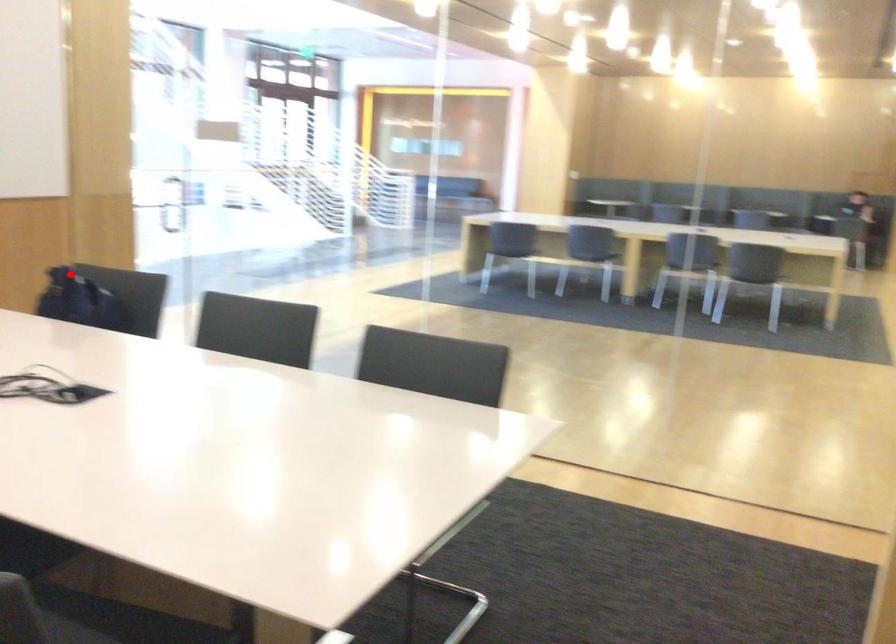
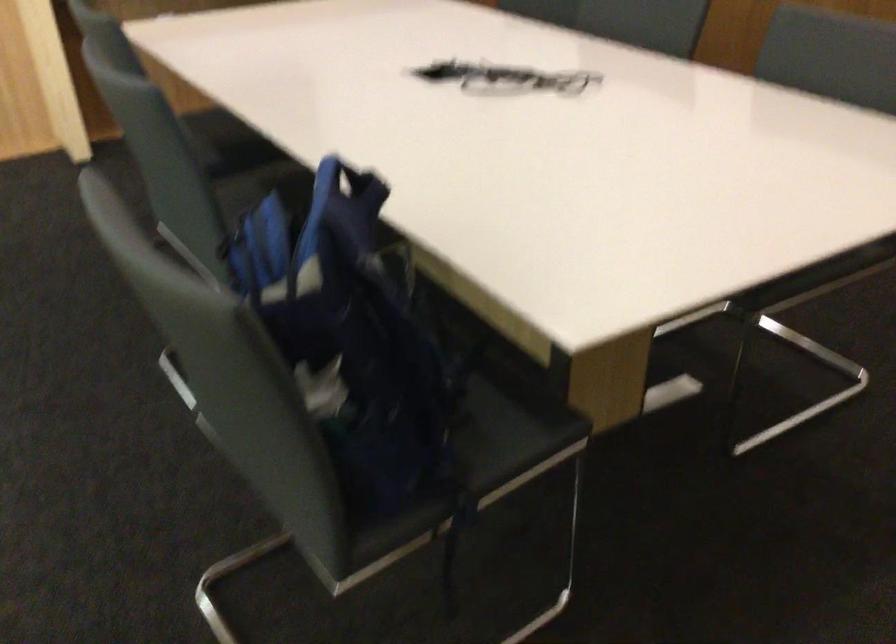
In the second image, find the point that corresponds to the highlighted location in the first image.

(349, 184)